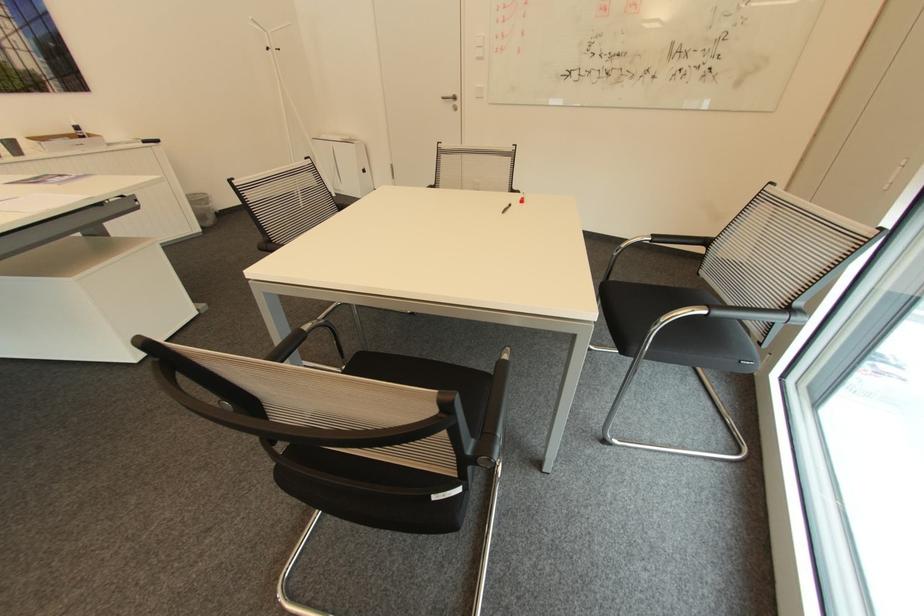
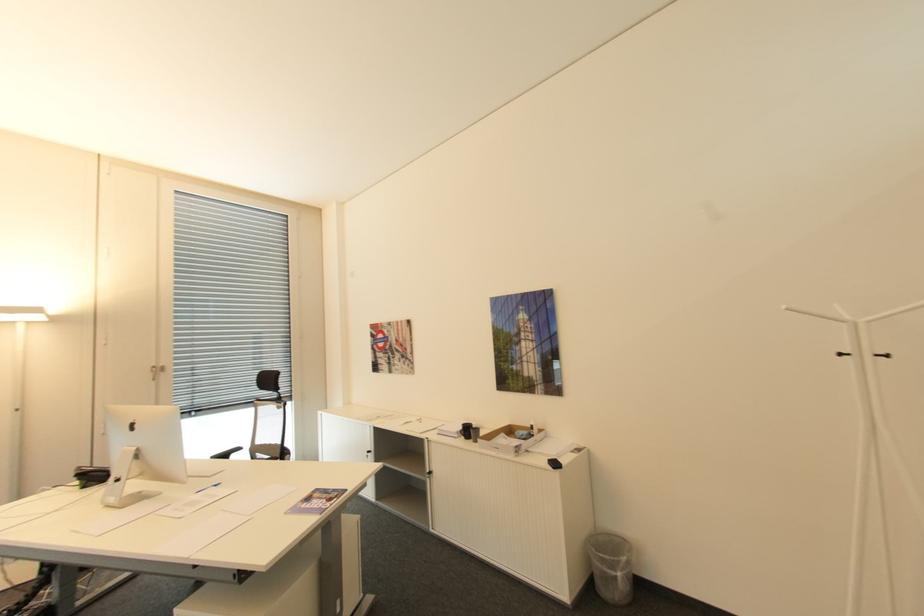
Where in the second image is the point corresponding to (x=273, y=47) from the first image?

(846, 355)